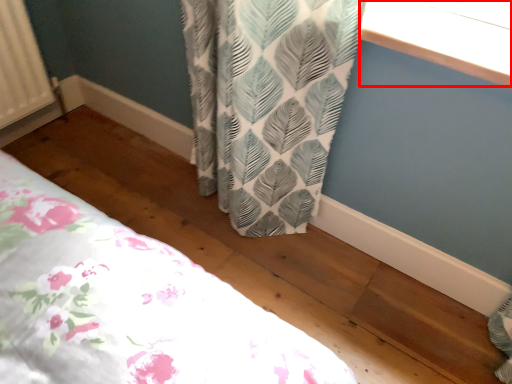
Question: From the image's perspective, what is the correct spatial relationship of window screen (annotated by the red box) in relation to bed?

Choices:
 (A) above
 (B) below

Answer: (A)